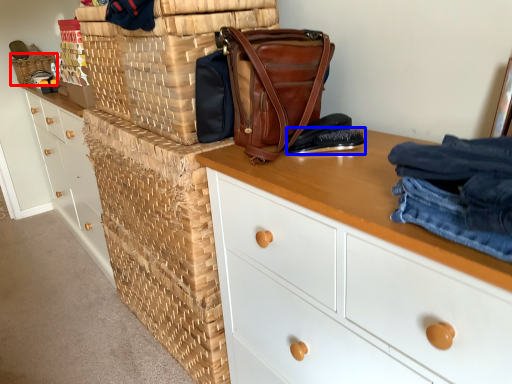
Question: Which object appears farthest to the camera in this image, basket (highlighted by a red box) or shoe (highlighted by a blue box)?

Choices:
 (A) basket
 (B) shoe

Answer: (A)